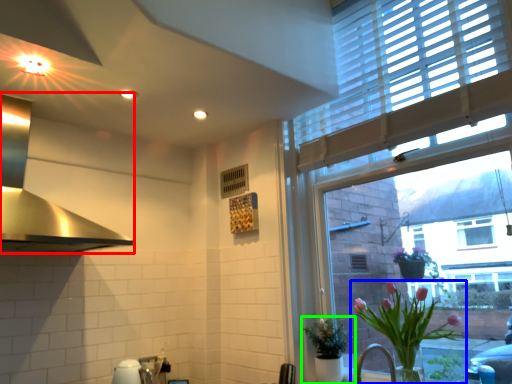
Question: Which object is the closest to the exhaust hood (highlighted by a red box)? Choose among these: houseplant (highlighted by a blue box) or houseplant (highlighted by a green box).

Choices:
 (A) houseplant
 (B) houseplant

Answer: (B)